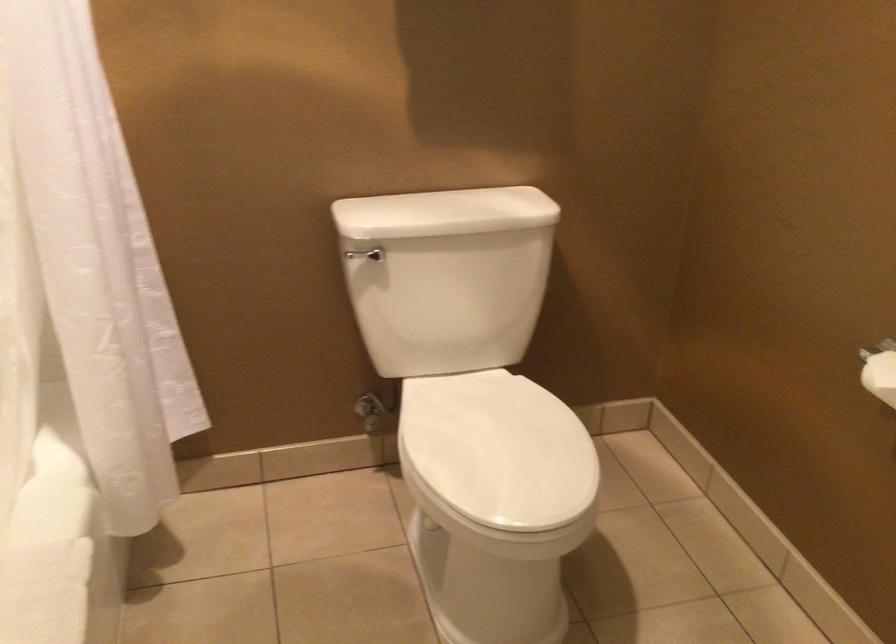
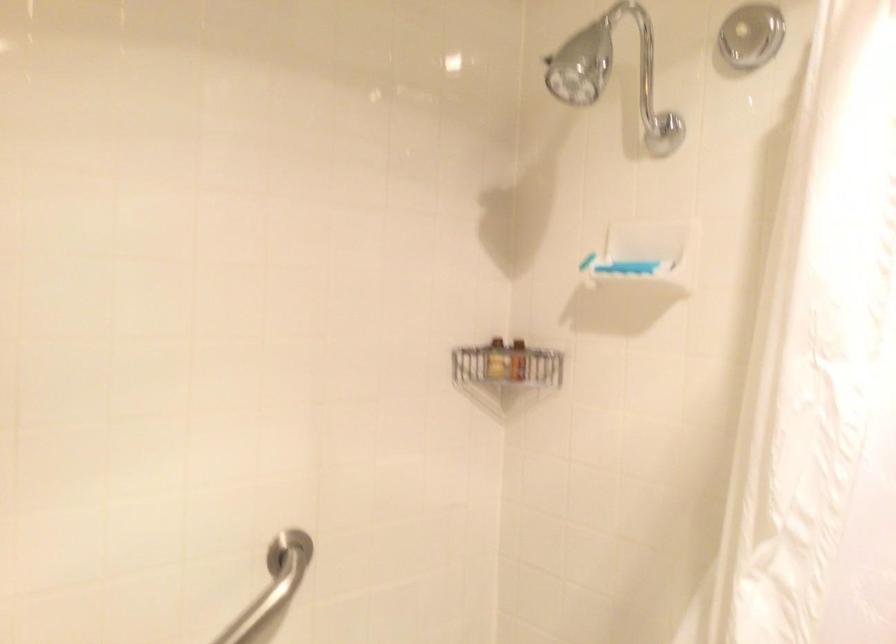
Question: The camera is either moving clockwise (left) or counter-clockwise (right) around the object. The first image is from the beginning of the video and the second image is from the end. Is the camera moving left or right when shooting the video?

Choices:
 (A) Left
 (B) Right

Answer: (B)